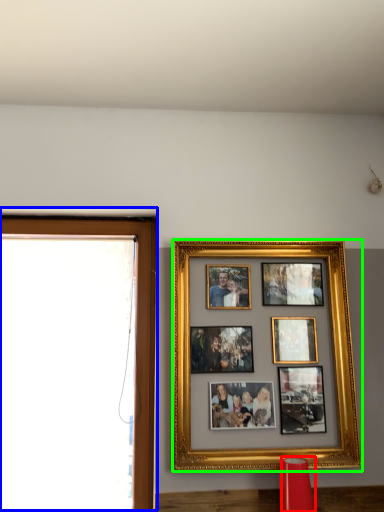
Question: Based on their relative distances, which object is farther from lamp (highlighted by a red box)? Choose from window frame (highlighted by a blue box) and picture frame (highlighted by a green box).

Choices:
 (A) window frame
 (B) picture frame

Answer: (A)